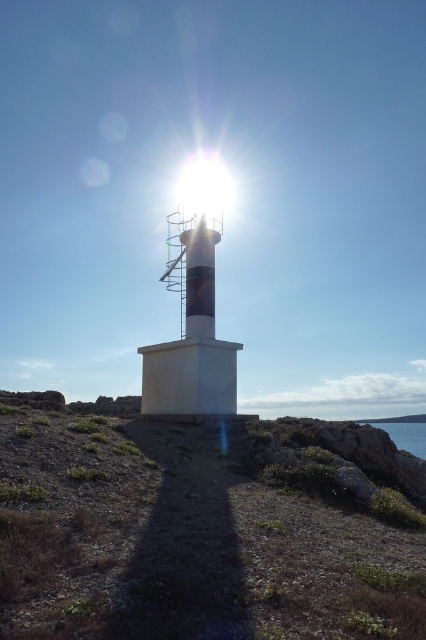
You are a hiker who has just arrived at the lighthouse. You notice a point marked at coordinates (201,529). Based on the scene description, what is the color and material of the surface at this point?

The point at coordinates (201,529) corresponds to dull brown dirt at center, so the surface there is dull brown in color and made of dirt.

You are a hiker who wants to take a photo of the lighthouse. You need to decide where to stand so that the dull brown dirt at center and blue water at lower right are both visible in the frame. Which object should you position closer to the edge of the photo to include both?

Since the dull brown dirt at center is wider than the blue water at lower right, you should position the blue water at lower right closer to the edge of the photo to ensure both are visible.

Looking at this image, you are a photographer trying to capture the lighthouse scene. You notice the bright white lens flare at upper center and the blue water at lower right. Which object in your viewfinder appears bigger? Please answer based on their sizes in the image.

The bright white lens flare at upper center appears bigger than the blue water at lower right in the image.